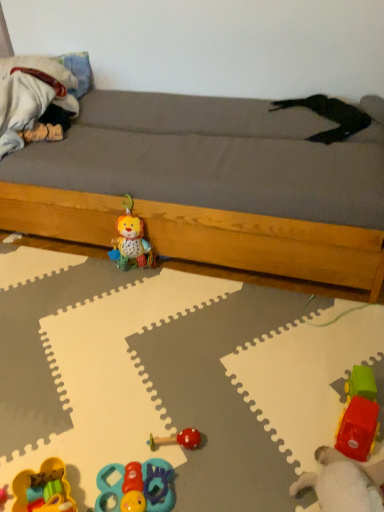
The width and height of the screenshot is (384, 512). What are the coordinates of `vacant area that lies between rubberized plastic truck at lower right, the 6th toy positioned from the left, and rubberized plastic car at lower right, the second toy from the right` in the screenshot? It's located at (320, 412).